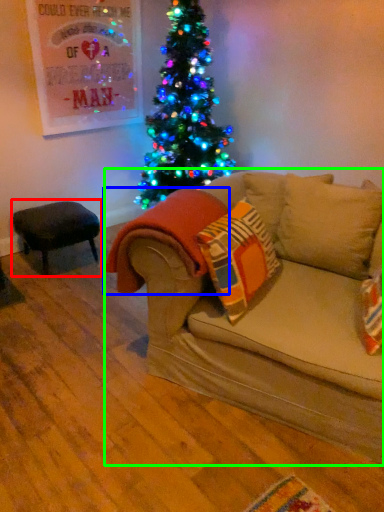
Question: Which object is the farthest from stool (highlighted by a red box)? Choose among these: blanket (highlighted by a blue box) or studio couch (highlighted by a green box).

Choices:
 (A) blanket
 (B) studio couch

Answer: (B)